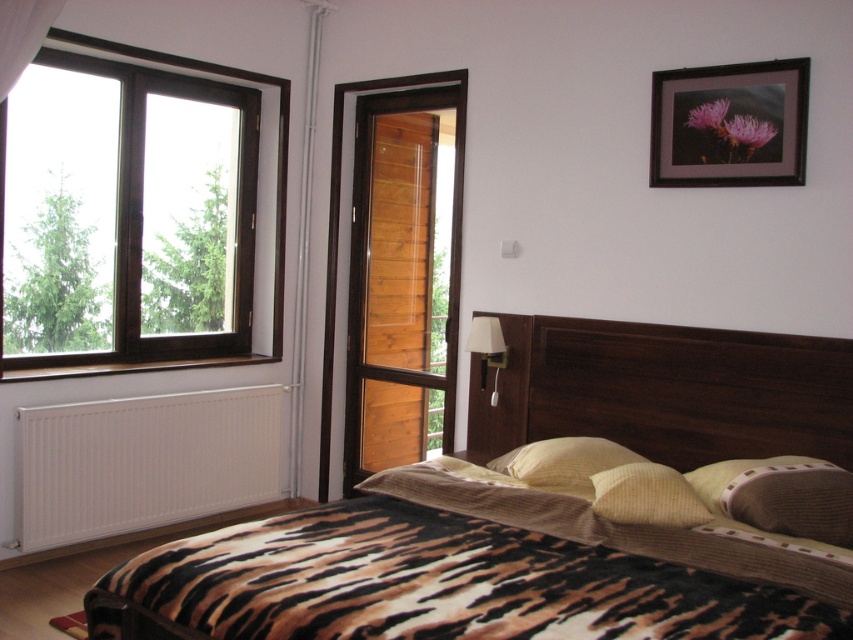
Question: Which object appears closest to the camera in this image?

Choices:
 (A) beige textured pillow at lower center
 (B) white matte radiator at lower left
 (C) black matte picture frame at upper right

Answer: (A)

Question: Does brown textured pillow at lower right have a smaller size compared to matte white lamp at upper right?

Choices:
 (A) yes
 (B) no

Answer: (B)

Question: Is brown wooden window at upper left in front of brown textured pillow at lower right?

Choices:
 (A) no
 (B) yes

Answer: (A)

Question: Which point is farther from the camera taking this photo?

Choices:
 (A) (845, 384)
 (B) (784, 129)

Answer: (B)

Question: Is white matte radiator at lower left wider than brown wooden window at upper left?

Choices:
 (A) yes
 (B) no

Answer: (B)

Question: Which object appears closest to the camera in this image?

Choices:
 (A) matte white lamp at upper right
 (B) dark wood headboard at center

Answer: (B)